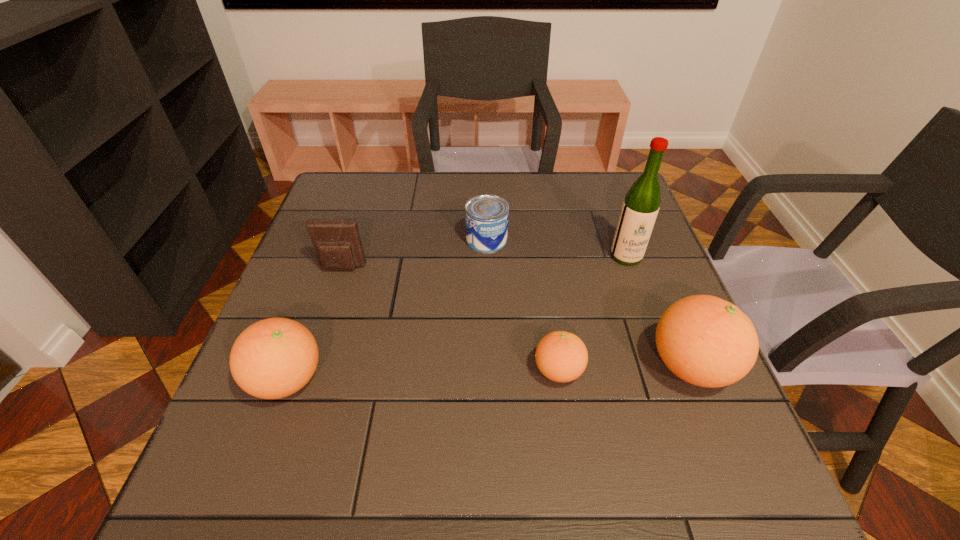
You are a GUI agent. You are given a task and a screenshot of the screen. Output one action in this format:
    pyautogui.click(x=<x>, y=<y>)
    Task: Click on the vacant point that satisfies the following two spatial constraints: 1. with an open flap on the pouch; 2. on the right side of the shortest orange
    The image size is (960, 540).
    Given the screenshot: What is the action you would take?
    pyautogui.click(x=308, y=371)

I want to click on blank space that satisfies the following two spatial constraints: 1. with an open flap on the rightmost orange; 2. on the left side of the pouch, so coord(310,366).

At what (x,y) coordinates should I click in order to perform the action: click on free region that satisfies the following two spatial constraints: 1. on the front label of the rightmost orange; 2. on the left side of the can. Please return your answer as a coordinate pair (x, y). The width and height of the screenshot is (960, 540). Looking at the image, I should click on (489, 366).